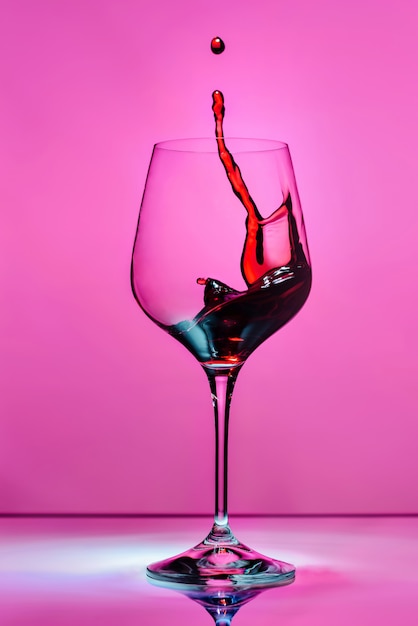
Identify the location of table. [x=113, y=563].